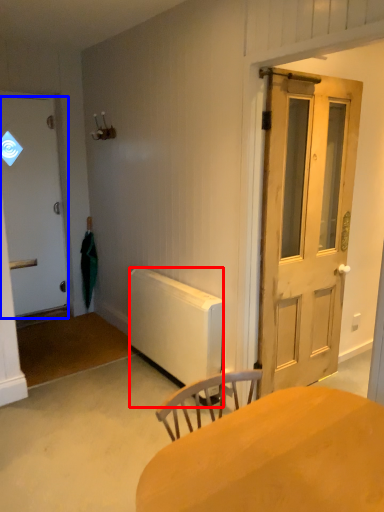
Question: Which of the following is the closest to the observer, radiator (highlighted by a red box) or door (highlighted by a blue box)?

Choices:
 (A) radiator
 (B) door

Answer: (A)